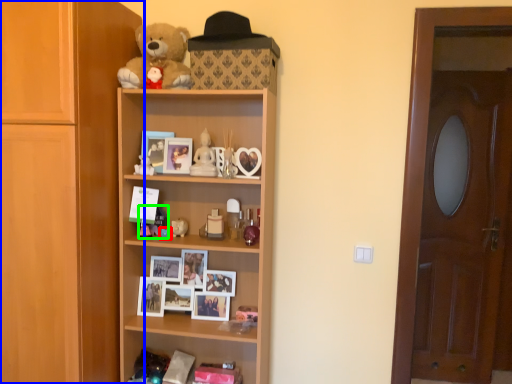
Question: Which object is the farthest from toy (highlighted by a red box)? Choose among these: cupboard (highlighted by a blue box) or toy (highlighted by a green box).

Choices:
 (A) cupboard
 (B) toy

Answer: (A)